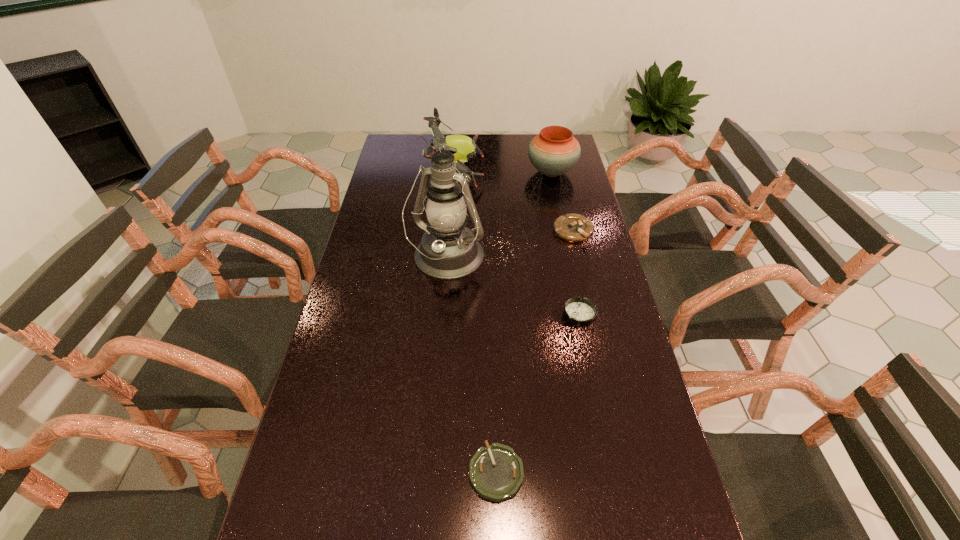
The width and height of the screenshot is (960, 540). In the image, there is a desktop. Find the location of `blank space at the left edge`. blank space at the left edge is located at coordinates (378, 187).

Where is `vacant space at the right edge of the desktop`? The width and height of the screenshot is (960, 540). vacant space at the right edge of the desktop is located at coordinates (652, 461).

You are a GUI agent. You are given a task and a screenshot of the screen. Output one action in this format:
    pyautogui.click(x=<x>, y=<y>)
    Task: Click on the unoccupied position between the third tallest object and the tallest object
    The width and height of the screenshot is (960, 540).
    Given the screenshot: What is the action you would take?
    pyautogui.click(x=499, y=216)

At what (x,y) coordinates should I click in order to perform the action: click on free spot between the pottery and the second nearest ashtray. Please return your answer as a coordinate pair (x, y). The image size is (960, 540). Looking at the image, I should click on (565, 244).

Where is `free space between the fifth farthest object and the nearest ashtray`? This screenshot has width=960, height=540. free space between the fifth farthest object and the nearest ashtray is located at coordinates coord(538,393).

Where is `vacant region between the shortest ashtray and the drone`? This screenshot has width=960, height=540. vacant region between the shortest ashtray and the drone is located at coordinates (475, 323).

In order to click on free space that is in between the pottery and the shortest object in this screenshot , I will do `click(524, 322)`.

Locate an element on the screen. The width and height of the screenshot is (960, 540). free area in between the third tallest object and the second shortest object is located at coordinates (565, 244).

At what (x,y) coordinates should I click in order to perform the action: click on free spot between the tallest ashtray and the third tallest object. Please return your answer as a coordinate pair (x, y). Image resolution: width=960 pixels, height=540 pixels. Looking at the image, I should click on (563, 201).

Identify the location of empty location between the fourth shortest object and the second tallest object. The image size is (960, 540). (503, 173).